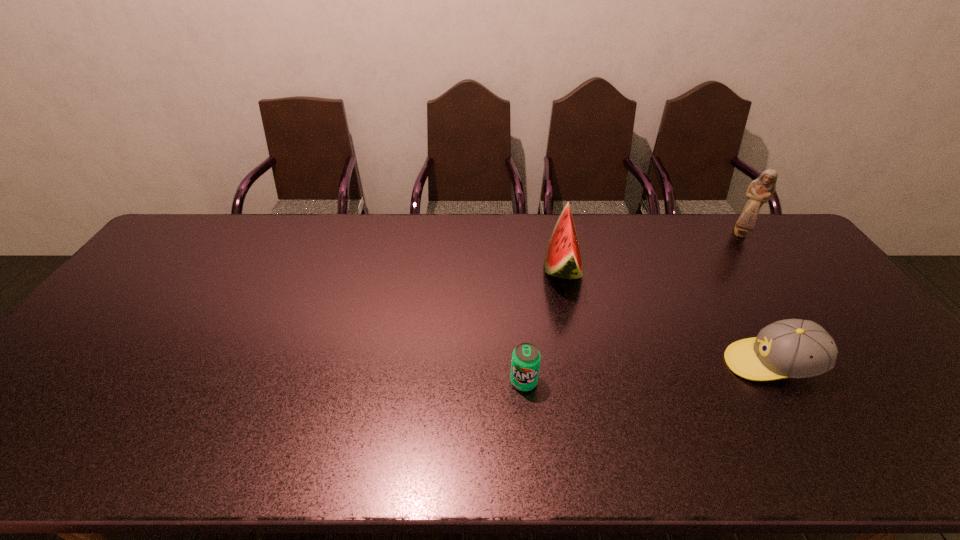
You are a GUI agent. You are given a task and a screenshot of the screen. Output one action in this format:
    pyautogui.click(x=<x>, y=<y>)
    Task: Click on the free space at the right edge of the desktop
    The image size is (960, 540).
    Given the screenshot: What is the action you would take?
    pyautogui.click(x=913, y=379)

The height and width of the screenshot is (540, 960). I want to click on vacant space at the far left corner, so pyautogui.click(x=203, y=240).

Locate an element on the screen. The width and height of the screenshot is (960, 540). free region at the far right corner of the desktop is located at coordinates click(x=757, y=232).

At what (x,y) coordinates should I click in order to perform the action: click on vacant point located between the watermelon and the third object from left to right. Please return your answer as a coordinate pair (x, y). The image size is (960, 540). Looking at the image, I should click on click(x=667, y=315).

Find the location of `free area in between the leftmost object and the watermelon`. free area in between the leftmost object and the watermelon is located at coordinates (543, 324).

In order to click on vacant point located between the tallest object and the baseball cap in this screenshot , I will do `click(756, 299)`.

What are the coordinates of `free space between the rightmost object and the leftmost object` in the screenshot? It's located at (632, 307).

Identify the location of free space that is in between the watermelon and the pop soda. Image resolution: width=960 pixels, height=540 pixels. (543, 324).

Identify the location of empty space that is in between the baseball cap and the figurine. (756, 299).

Find the location of `free space between the baseball cap and the third shortest object`. free space between the baseball cap and the third shortest object is located at coordinates (667, 315).